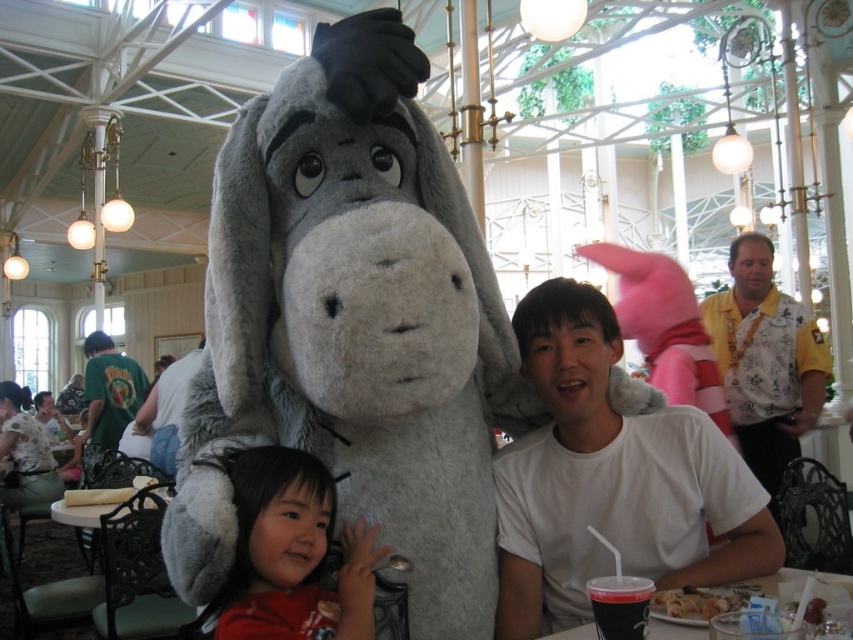
Does point (432, 356) come in front of point (305, 580)?

Yes, point (432, 356) is in front of point (305, 580).

Is fluffy gray plush at center to the right of smooth red shirt at lower left from the viewer's perspective?

Yes, fluffy gray plush at center is to the right of smooth red shirt at lower left.

Is point (225, 416) less distant than point (314, 493)?

No, it is not.

At what (x,y) coordinates should I click in order to perform the action: click on fluffy gray plush at center. Please return your answer as a coordinate pair (x, y). The width and height of the screenshot is (853, 640). Looking at the image, I should click on (352, 346).

Is point (169, 376) behind point (776, 593)?

That is True.

Is point (192, 355) less distant than point (544, 637)?

No, (192, 355) is further to viewer.

Where is `white t-shirt at center`? The width and height of the screenshot is (853, 640). white t-shirt at center is located at coordinates 166,410.

Does white cotton shirt at center have a smaller size compared to yellow printed shirt at right?

Yes, white cotton shirt at center is smaller than yellow printed shirt at right.

Between point (730, 548) and point (793, 310), which one is positioned in front?

Positioned in front is point (730, 548).

Where is `white cotton shirt at center`? The height and width of the screenshot is (640, 853). white cotton shirt at center is located at coordinates (611, 477).